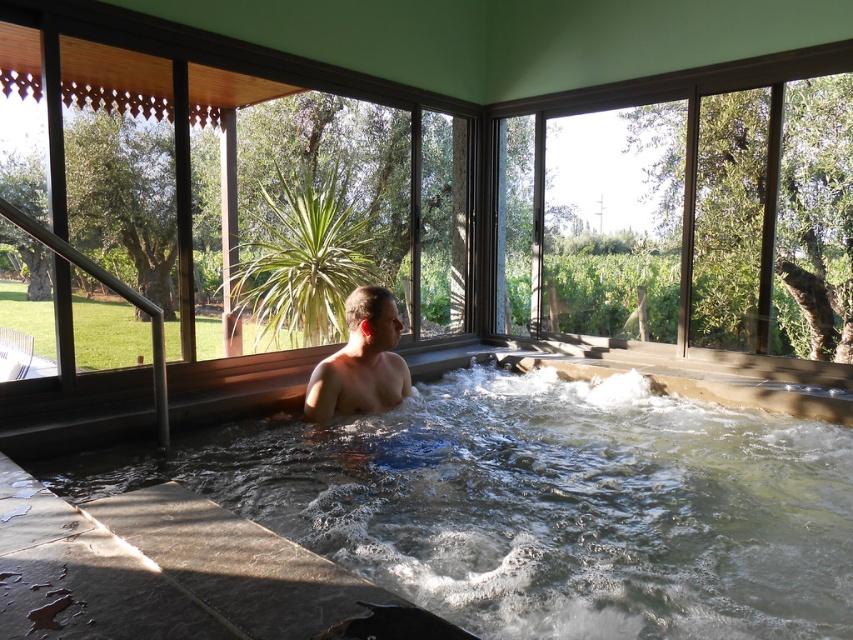
Question: Is clear acrylic hot tub at center smaller than smooth skin man at center?

Choices:
 (A) yes
 (B) no

Answer: (B)

Question: Is the position of clear acrylic hot tub at center less distant than that of smooth skin man at center?

Choices:
 (A) yes
 (B) no

Answer: (A)

Question: Which point is farther to the camera?

Choices:
 (A) clear acrylic hot tub at center
 (B) smooth skin man at center

Answer: (B)

Question: Which object appears closest to the camera in this image?

Choices:
 (A) clear acrylic hot tub at center
 (B) smooth skin man at center

Answer: (A)

Question: Can you confirm if clear acrylic hot tub at center is thinner than smooth skin man at center?

Choices:
 (A) no
 (B) yes

Answer: (A)